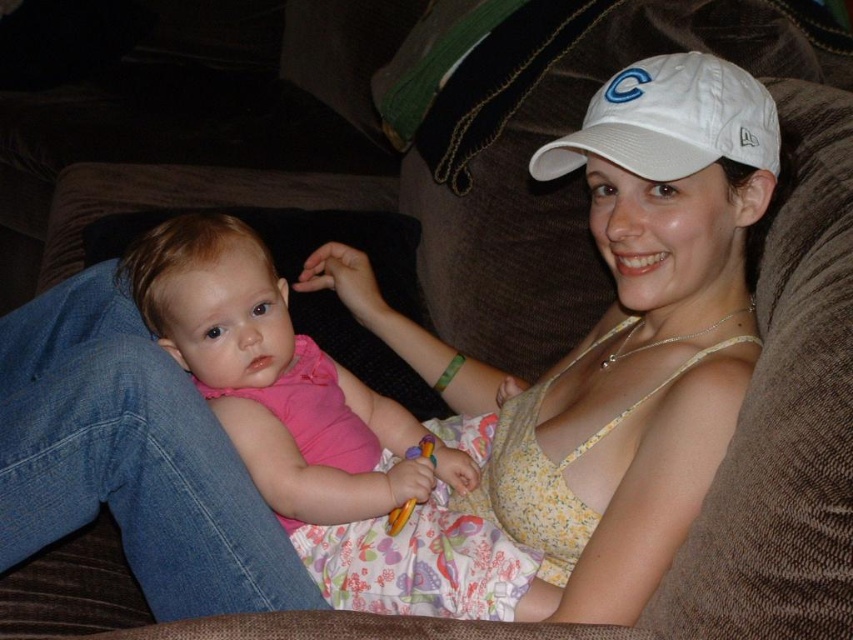
Question: Considering the relative positions of pink fabric baby at center and white fabric cap at upper center in the image provided, where is pink fabric baby at center located with respect to white fabric cap at upper center?

Choices:
 (A) left
 (B) right

Answer: (A)

Question: Considering the relative positions of pink fabric baby at center and white fabric cap at upper center in the image provided, where is pink fabric baby at center located with respect to white fabric cap at upper center?

Choices:
 (A) right
 (B) left

Answer: (B)

Question: Does pink fabric baby at center have a smaller size compared to white fabric cap at upper center?

Choices:
 (A) yes
 (B) no

Answer: (B)

Question: Among these points, which one is nearest to the camera?

Choices:
 (A) (248, 228)
 (B) (677, 131)

Answer: (B)